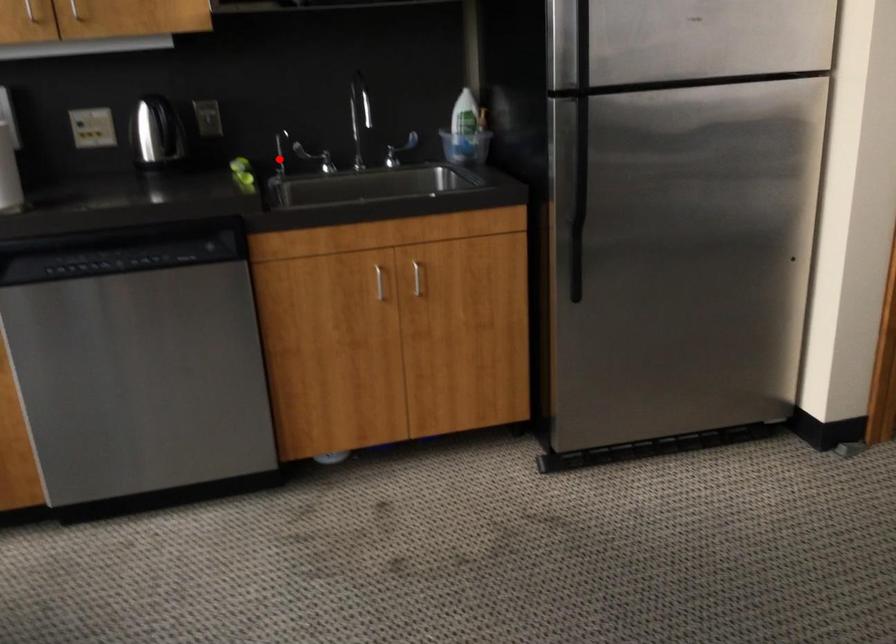
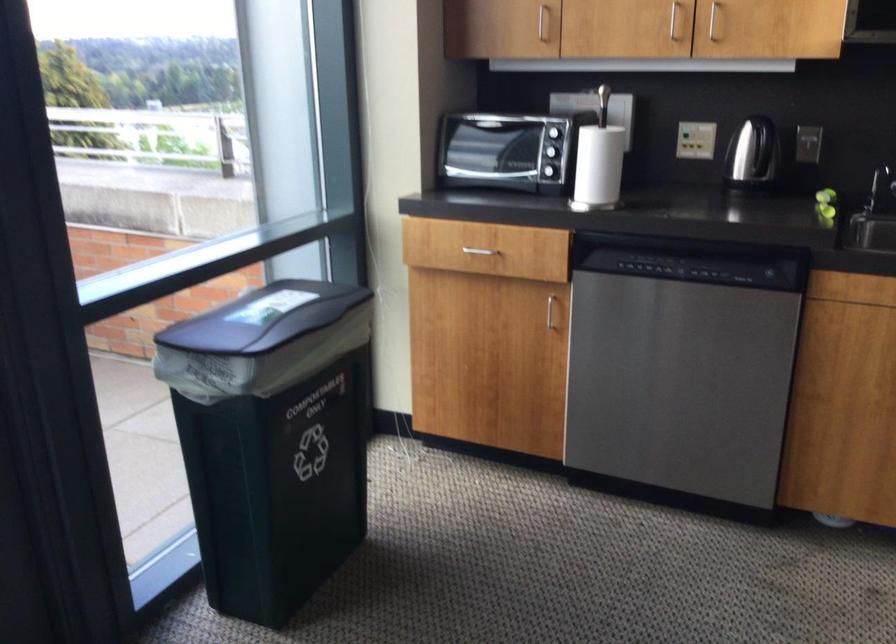
Question: I am providing you with two images of the same scene from different viewpoints. A red point is shown in image1. For the corresponding object point in image2, is it positioned nearer or farther from the camera?

Choices:
 (A) Nearer
 (B) Farther

Answer: (A)